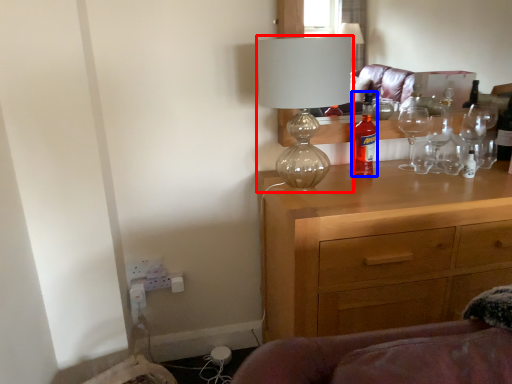
Question: Which object is closer to the camera taking this photo, lamp (highlighted by a red box) or bottle (highlighted by a blue box)?

Choices:
 (A) lamp
 (B) bottle

Answer: (A)